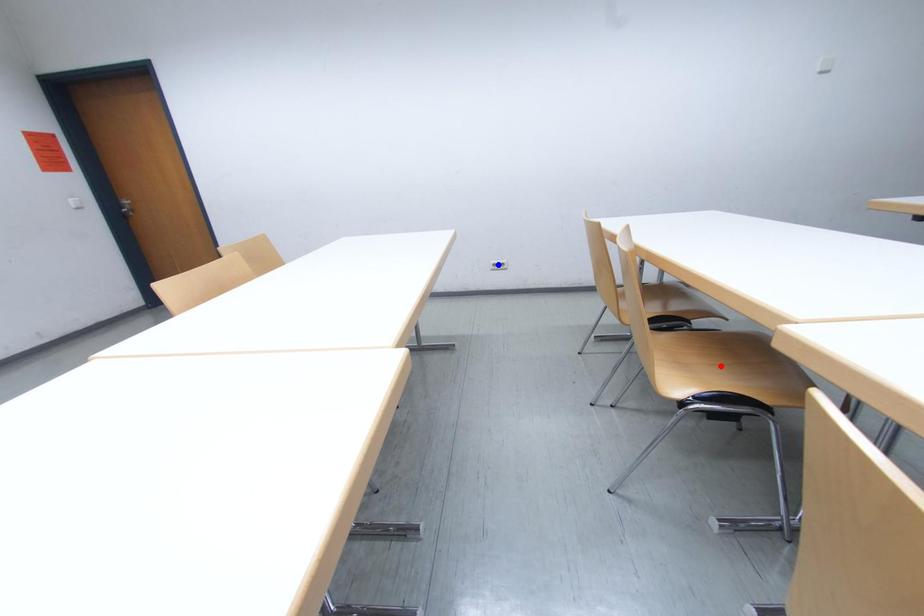
Question: Two points are marked on the image. Which point is closer to the camera?

Choices:
 (A) Blue point is closer.
 (B) Red point is closer.

Answer: (B)